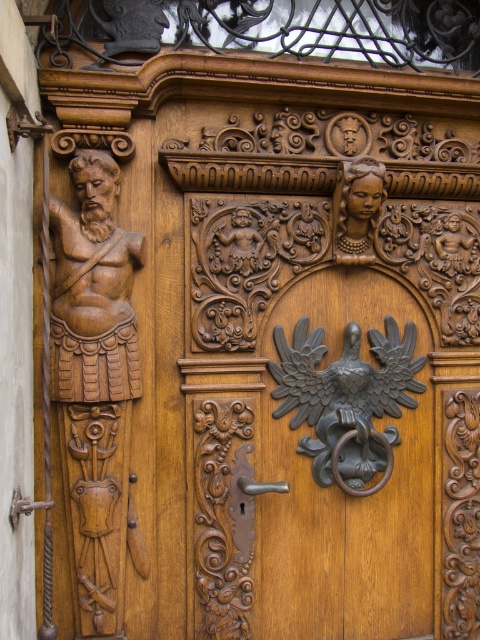
Question: Is polished bronze eagle at center below polished silver door handle at center?

Choices:
 (A) no
 (B) yes

Answer: (A)

Question: Which point appears farthest from the camera in this image?

Choices:
 (A) (260, 490)
 (B) (328, 396)
 (C) (21, 500)

Answer: (B)

Question: Which of these objects is positioned farthest from the wooden carving at left?

Choices:
 (A) polished bronze eagle at center
 (B) polished brass door handle at lower left

Answer: (A)

Question: Is polished bronze eagle at center below wooden carving at upper center?

Choices:
 (A) yes
 (B) no

Answer: (A)

Question: Which object is closer to the camera taking this photo?

Choices:
 (A) polished bronze eagle at center
 (B) polished silver door handle at center
 (C) wooden carving at upper center

Answer: (B)

Question: Does wooden carving at left appear over wooden carving at upper center?

Choices:
 (A) no
 (B) yes

Answer: (A)